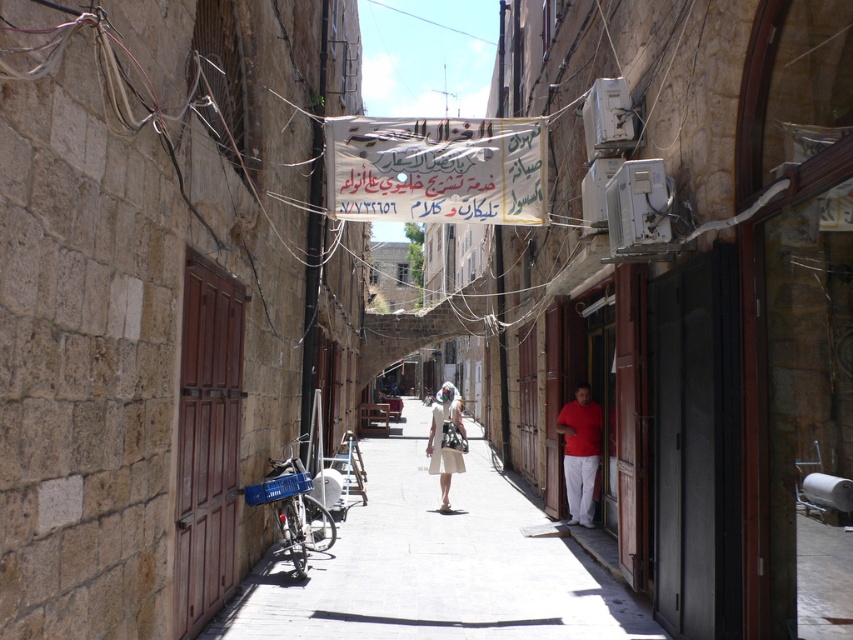
Question: Which point is closer to the camera?

Choices:
 (A) (444, 496)
 (B) (450, 467)
 (C) (453, 602)
 (D) (563, 417)

Answer: (C)

Question: Is matte red shirt at right to the right of beige fabric dress at center from the viewer's perspective?

Choices:
 (A) yes
 (B) no

Answer: (A)

Question: Can you confirm if smooth stone pavement at center is smaller than beige fabric dress at center?

Choices:
 (A) no
 (B) yes

Answer: (B)

Question: Which of these objects is positioned farthest from the beige fabric dress at center?

Choices:
 (A) white cotton dress at center
 (B) smooth stone pavement at center

Answer: (B)

Question: Is smooth stone pavement at center below matte red shirt at right?

Choices:
 (A) no
 (B) yes

Answer: (B)

Question: Estimate the real-world distances between objects in this image. Which object is closer to the smooth stone pavement at center?

Choices:
 (A) white cotton dress at center
 (B) matte red shirt at right
 (C) beige fabric dress at center

Answer: (B)